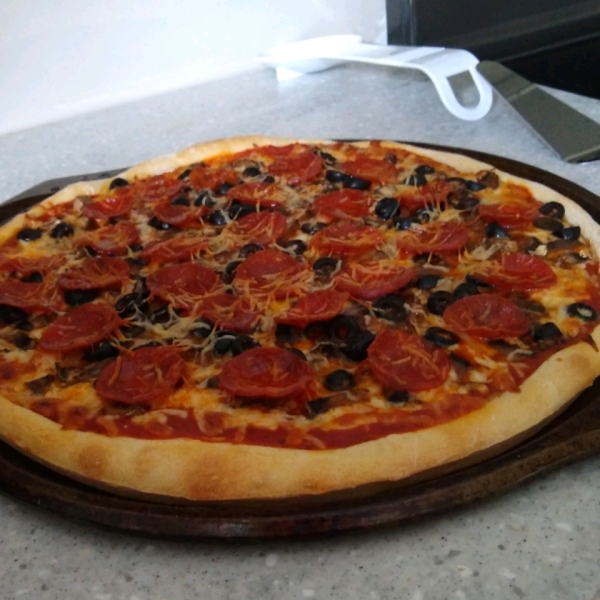
Where is `plastic measuring spoon`? plastic measuring spoon is located at coordinates (357, 53).